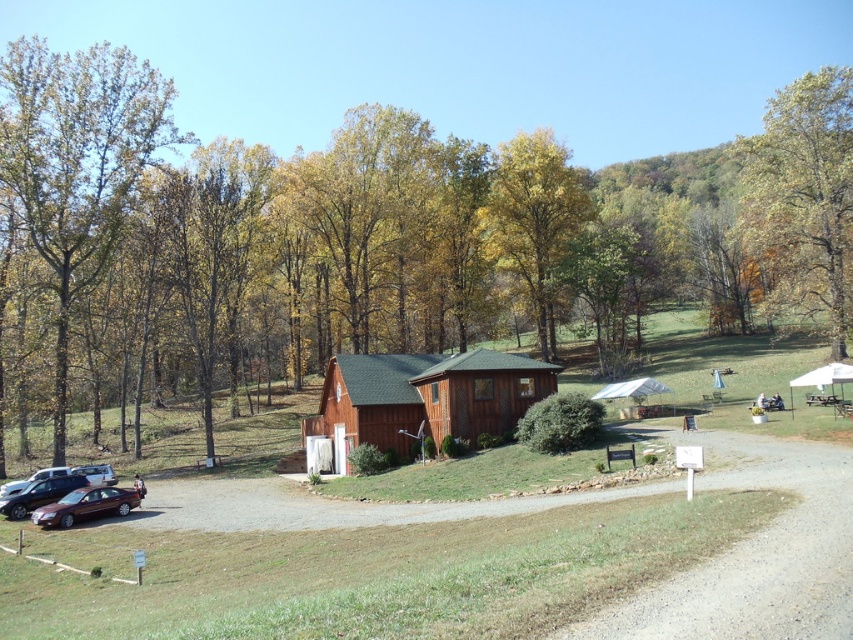
Question: Does brown wood cabin at center appear on the right side of shiny black sedan at lower left?

Choices:
 (A) no
 (B) yes

Answer: (B)

Question: Based on their relative distances, which object is farther from the yellow-green leaves at center?

Choices:
 (A) brown wooden hut at center
 (B) shiny black sedan at lower left

Answer: (B)

Question: Which point is closer to the camera?

Choices:
 (A) green leafy tree at left
 (B) brown wood cabin at center
 (C) yellow-green leaves at upper right
 (D) yellow-green leaves at center

Answer: (B)

Question: Is wooden cabin at center bigger than brown wooden hut at center?

Choices:
 (A) yes
 (B) no

Answer: (A)

Question: Which object appears closest to the camera in this image?

Choices:
 (A) wooden cabin at center
 (B) satin brown sedan at lower left
 (C) green leafy tree at left
 (D) brown wood cabin at center

Answer: (A)

Question: Is brown wood cabin at center wider than brown wooden hut at center?

Choices:
 (A) no
 (B) yes

Answer: (B)